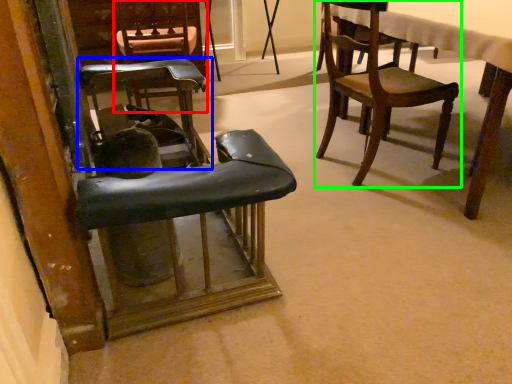
Question: Which object is positioned closest to chair (highlighted by a red box)? Select from chair (highlighted by a blue box) and chair (highlighted by a green box).

Choices:
 (A) chair
 (B) chair

Answer: (A)